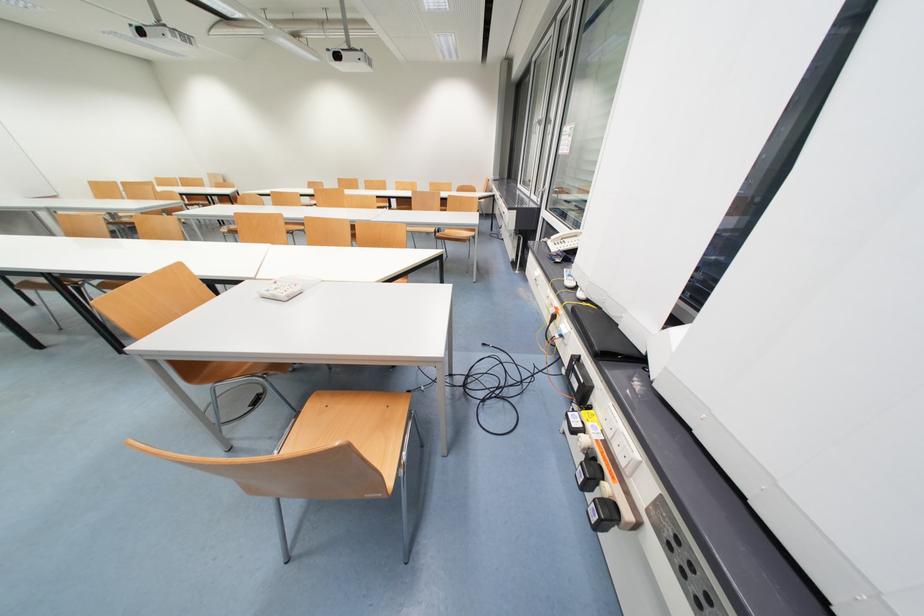
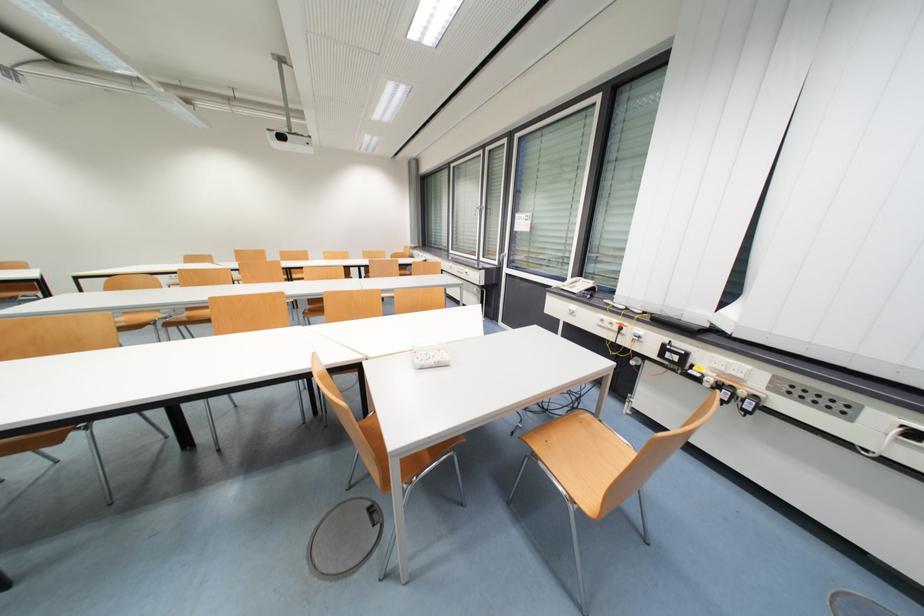
Find the pixel in the second image that matches the point at 280,297 in the first image.

(444, 363)